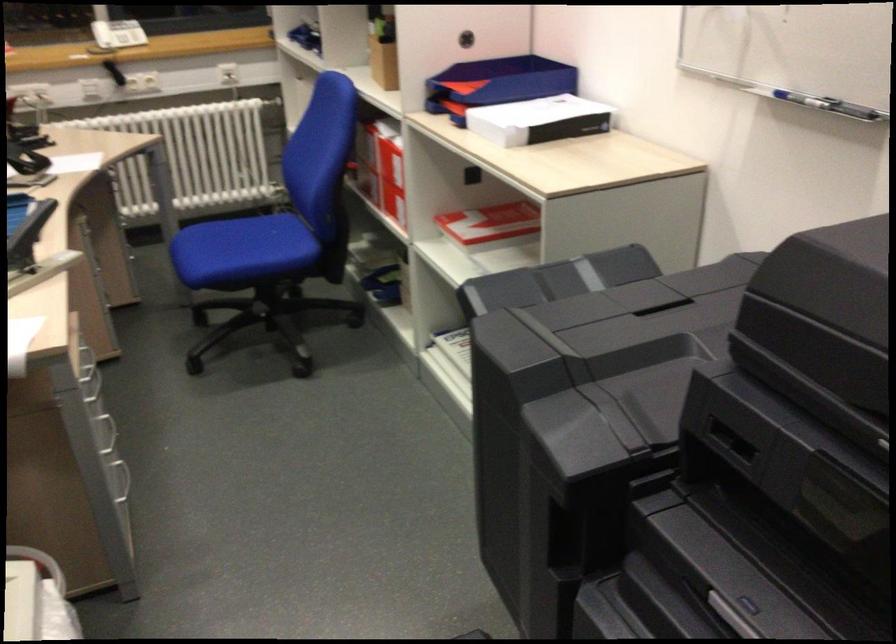
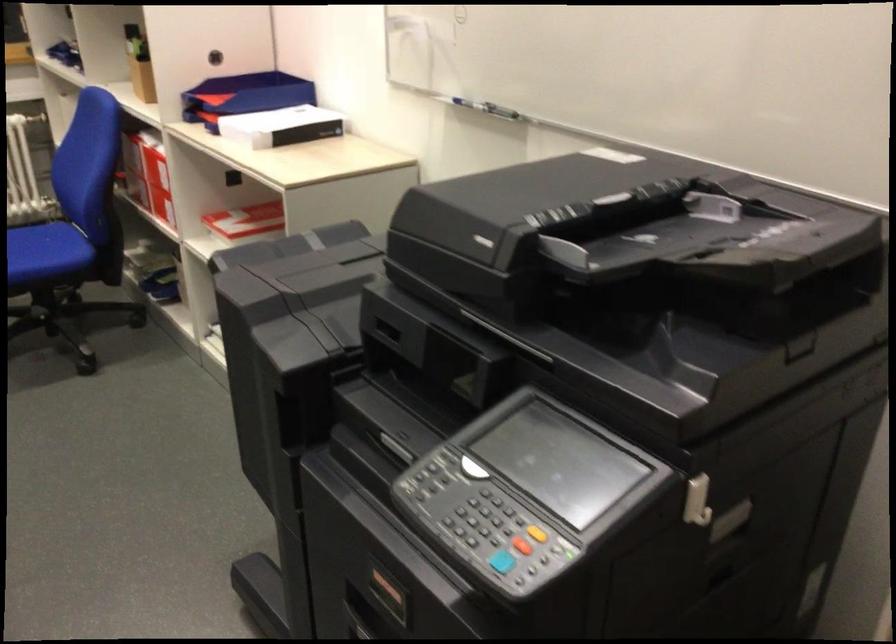
Question: How did the camera likely rotate?

Choices:
 (A) Left
 (B) Right
 (C) Up
 (D) Down

Answer: (B)